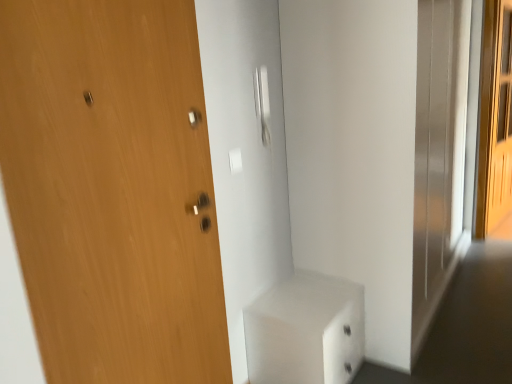
Question: Looking at their shapes, would you say light brown wooden screen door at right is wider or thinner than wooden door at left?

Choices:
 (A) wide
 (B) thin

Answer: (A)

Question: Considering the positions of point (477, 226) and point (145, 66), is point (477, 226) closer or farther from the camera than point (145, 66)?

Choices:
 (A) closer
 (B) farther

Answer: (B)

Question: Estimate the real-world distances between objects in this image. Which object is closer to the light brown wooden screen door at right?

Choices:
 (A) satin silver door handle at center
 (B) wooden door at left
 (C) white glossy cabinet at lower center

Answer: (A)

Question: Estimate the real-world distances between objects in this image. Which object is closer to the light brown wooden screen door at right?

Choices:
 (A) wooden door at left
 (B) white glossy cabinet at lower center
 (C) satin silver door handle at center

Answer: (C)